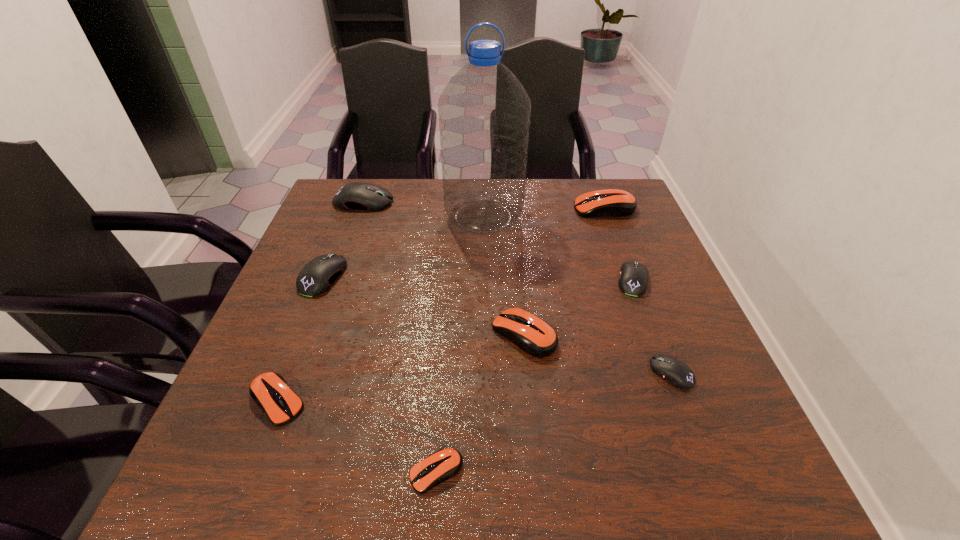
Where is `free spot between the nearest computer mouse and the biggest black computer equipment`? The width and height of the screenshot is (960, 540). free spot between the nearest computer mouse and the biggest black computer equipment is located at coordinates (400, 337).

Find the location of `free area in between the rightmost orange computer mouse and the second farthest orange computer mouse`. free area in between the rightmost orange computer mouse and the second farthest orange computer mouse is located at coordinates (564, 272).

What are the coordinates of `empty space that is in between the second farthest orange computer mouse and the smallest black computer equipment` in the screenshot? It's located at (598, 354).

I want to click on object that is the eighth closest one to the second biggest black computer equipment, so click(x=677, y=373).

I want to click on object identified as the fifth closest to the second orange computer mouse from left to right, so click(x=633, y=280).

I want to click on computer mouse that is the eighth closest one to the blue water jug, so click(x=445, y=463).

Identify the location of computer mouse that is the seventh closest to the second nearest orange computer mouse. (611, 202).

The image size is (960, 540). I want to click on black computer equipment that stands as the second closest to the second smallest orange computer mouse, so click(353, 196).

Find the location of a particular element. The width and height of the screenshot is (960, 540). the third closest black computer equipment to the third smallest black computer equipment is located at coordinates (677, 373).

Identify which orange computer mouse is the closest to the biggest orange computer mouse. Please provide its 2D coordinates. Your answer should be formatted as a tuple, i.e. [(x, y)], where the tuple contains the x and y coordinates of a point satisfying the conditions above.

[(536, 337)]